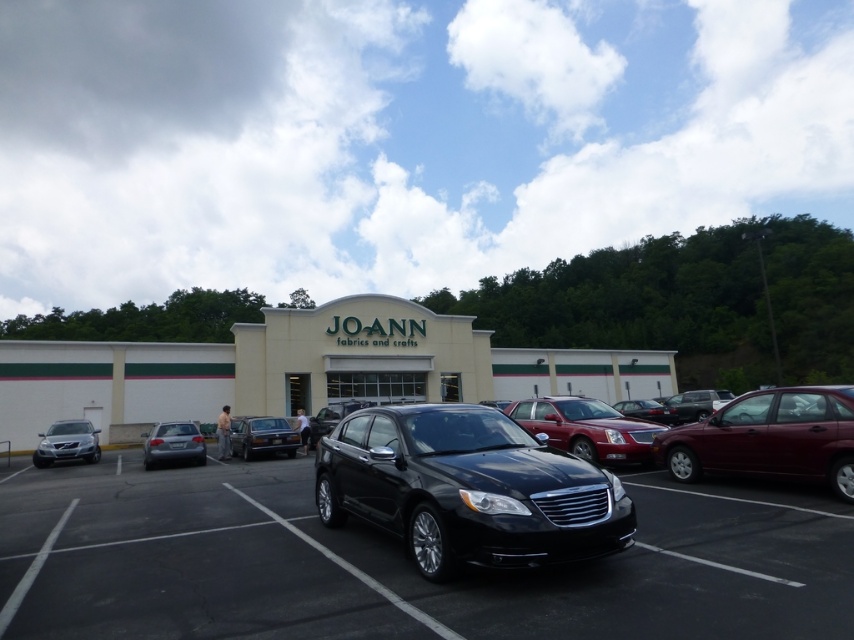
Question: Is black glossy sedan at center closer to the viewer compared to shiny red sedan at center?

Choices:
 (A) no
 (B) yes

Answer: (B)

Question: Which of these objects is positioned closest to the shiny silver sedan at center?

Choices:
 (A) satin silver sedan at left
 (B) glossy maroon sedan at right
 (C) satin silver sedan at lower left
 (D) shiny red sedan at center

Answer: (C)

Question: Which of the following is the farthest from the observer?

Choices:
 (A) (513, 496)
 (B) (641, 438)
 (C) (270, 440)
 (D) (147, 460)

Answer: (C)

Question: Which object is farther from the camera taking this photo?

Choices:
 (A) shiny red sedan at center
 (B) satin silver sedan at left
 (C) satin silver sedan at lower left
 (D) shiny silver sedan at center

Answer: (B)

Question: Is black car at center thinner than glossy maroon sedan at right?

Choices:
 (A) no
 (B) yes

Answer: (A)

Question: Does black glossy sedan at center appear under satin silver sedan at left?

Choices:
 (A) yes
 (B) no

Answer: (B)